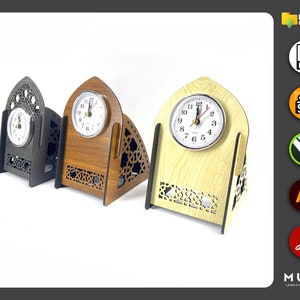
The image size is (300, 300). I want to click on 1 white surface, so click(108, 238).